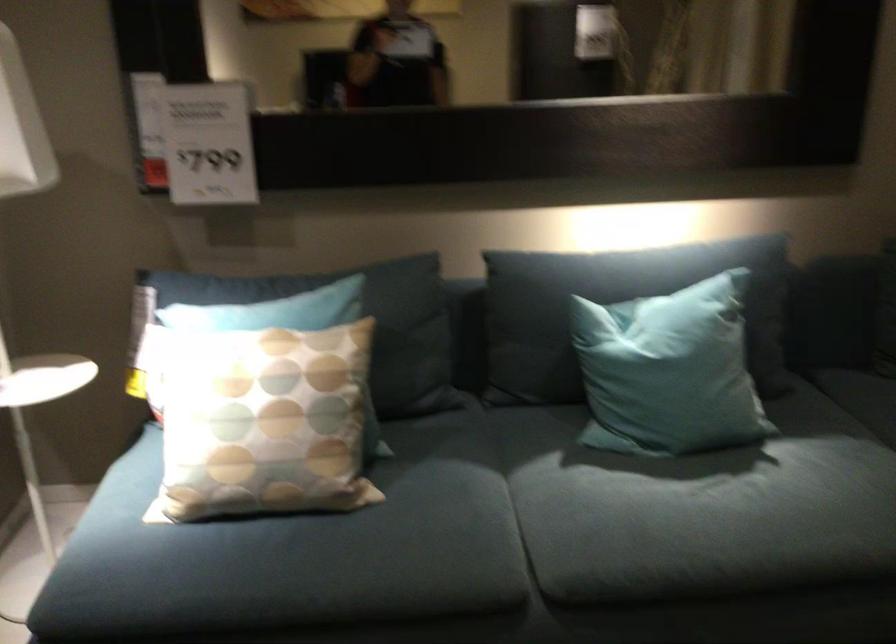
You are a GUI agent. You are given a task and a screenshot of the screen. Output one action in this format:
    pyautogui.click(x=<x>, y=<y>)
    Task: Click on the sofa sitting surface
    This screenshot has height=644, width=896.
    Given the screenshot: What is the action you would take?
    pyautogui.click(x=406, y=526)